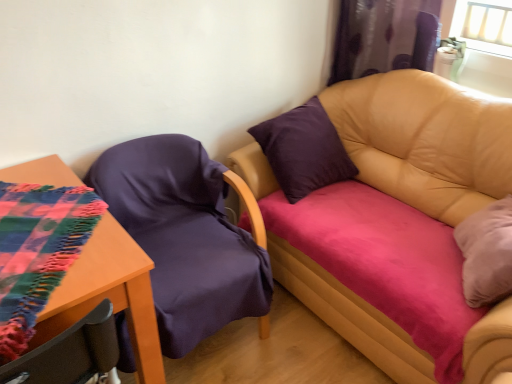
Question: Is purple satin curtain at upper right surrounding purple fabric chair at left?

Choices:
 (A) no
 (B) yes

Answer: (A)

Question: Is purple satin curtain at upper right wider than purple fabric chair at left?

Choices:
 (A) yes
 (B) no

Answer: (B)

Question: Is purple satin curtain at upper right at the left side of purple fabric chair at left?

Choices:
 (A) no
 (B) yes

Answer: (A)

Question: Is the position of purple satin curtain at upper right more distant than that of purple fabric chair at left?

Choices:
 (A) no
 (B) yes

Answer: (B)

Question: Is purple satin curtain at upper right touching purple fabric chair at left?

Choices:
 (A) no
 (B) yes

Answer: (A)

Question: From a real-world perspective, is purple satin curtain at upper right positioned above or below leather couch at upper right?

Choices:
 (A) below
 (B) above

Answer: (B)

Question: Does point (362, 62) appear closer or farther from the camera than point (410, 370)?

Choices:
 (A) farther
 (B) closer

Answer: (A)

Question: Choose the correct answer: Is purple satin curtain at upper right inside leather couch at upper right or outside it?

Choices:
 (A) outside
 (B) inside

Answer: (A)

Question: From the image's perspective, is purple satin curtain at upper right located above or below leather couch at upper right?

Choices:
 (A) above
 (B) below

Answer: (A)

Question: Does point (146, 370) appear closer or farther from the camera than point (335, 76)?

Choices:
 (A) closer
 (B) farther

Answer: (A)

Question: Is wooden table at lower left taller or shorter than purple satin curtain at upper right?

Choices:
 (A) short
 (B) tall

Answer: (B)

Question: From the image's perspective, is wooden table at lower left above or below purple satin curtain at upper right?

Choices:
 (A) above
 (B) below

Answer: (B)

Question: In terms of width, does wooden table at lower left look wider or thinner when compared to purple satin curtain at upper right?

Choices:
 (A) thin
 (B) wide

Answer: (B)

Question: Considering the positions of wooden table at lower left and leather couch at upper right in the image, is wooden table at lower left taller or shorter than leather couch at upper right?

Choices:
 (A) tall
 (B) short

Answer: (B)

Question: Based on their positions, is wooden table at lower left located to the left or right of leather couch at upper right?

Choices:
 (A) right
 (B) left

Answer: (B)